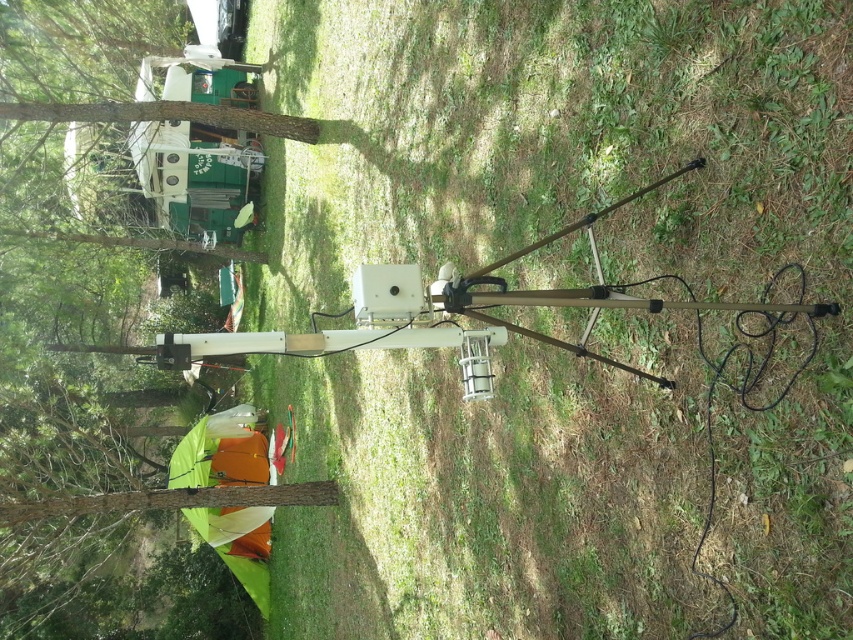
Can you confirm if green grass at center is thinner than brown wood tree at left?

Correct, green grass at center's width is less than brown wood tree at left's.

In the scene shown: Between green grass at center and brown wood tree at left, which one is positioned higher?

brown wood tree at left is higher up.

Between point (331, 100) and point (131, 284), which one is positioned behind?

The point (131, 284) is more distant.

Where is `green grass at center`? The image size is (853, 640). green grass at center is located at coordinates (596, 202).